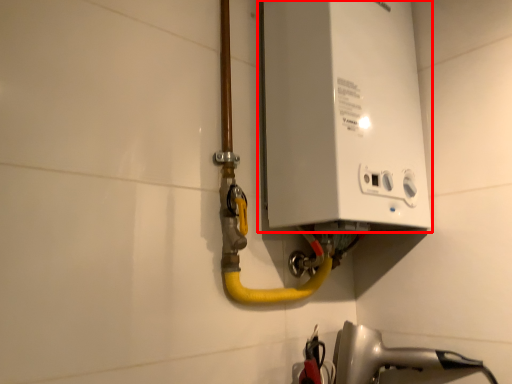
Question: From the image's perspective, what is the correct spatial relationship of appliance (annotated by the red box) in relation to plumbing fixture?

Choices:
 (A) above
 (B) below

Answer: (A)